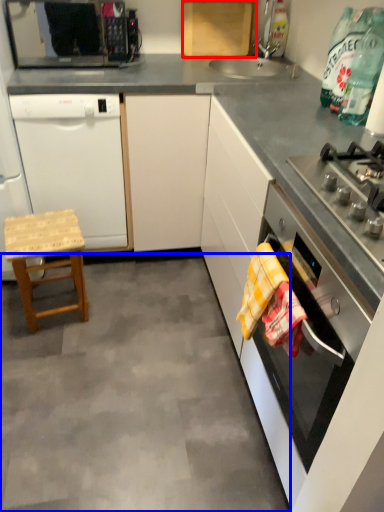
Question: Which object is closer to the camera taking this photo, cabinetry (highlighted by a red box) or concrete (highlighted by a blue box)?

Choices:
 (A) cabinetry
 (B) concrete

Answer: (B)